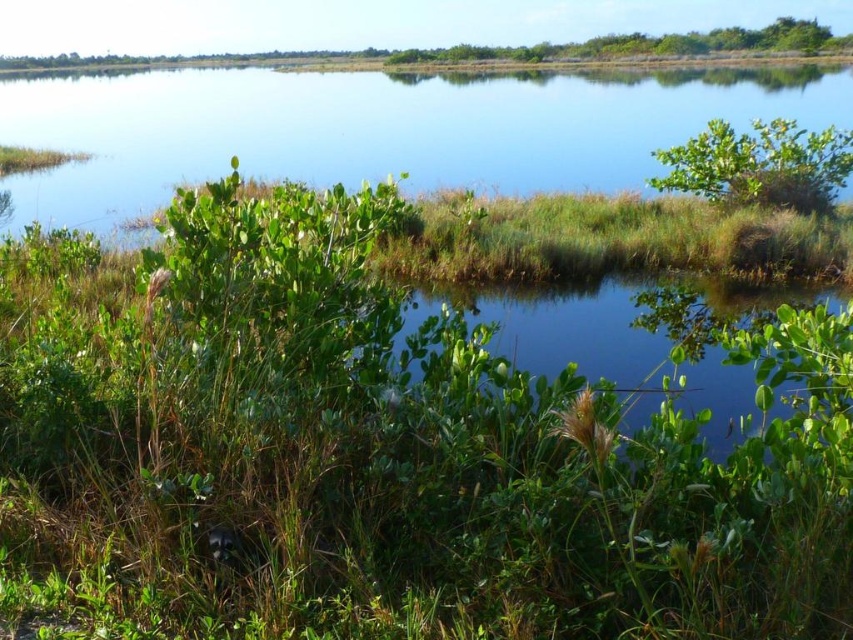
Question: Considering the relative positions of green grassy water at upper center and green leafy bush at upper right in the image provided, where is green grassy water at upper center located with respect to green leafy bush at upper right?

Choices:
 (A) left
 (B) right

Answer: (A)

Question: Among these points, which one is farthest from the camera?

Choices:
 (A) (582, 116)
 (B) (718, 140)

Answer: (A)

Question: In this image, where is green grassy water at upper center located relative to green leafy bush at upper right?

Choices:
 (A) left
 (B) right

Answer: (A)

Question: Is green grassy water at upper center wider than green leafy bush at upper right?

Choices:
 (A) yes
 (B) no

Answer: (A)